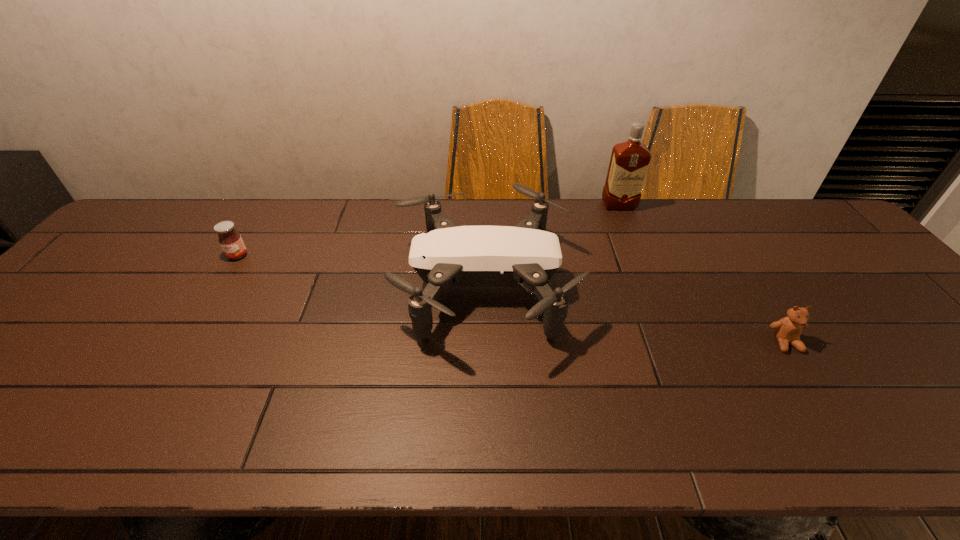
You are a GUI agent. You are given a task and a screenshot of the screen. Output one action in this format:
    pyautogui.click(x=<x>, y=<y>)
    Task: Click on the unoccupied area between the drone and the rightmost object
    
    Given the screenshot: What is the action you would take?
    pyautogui.click(x=635, y=313)

The image size is (960, 540). What are the coordinates of `empty space between the jam and the third shortest object` in the screenshot? It's located at (360, 270).

Image resolution: width=960 pixels, height=540 pixels. I want to click on free space between the jam and the second tallest object, so click(x=360, y=270).

Image resolution: width=960 pixels, height=540 pixels. I want to click on unoccupied position between the drone and the jam, so click(360, 270).

Identify the location of free space between the rightmost object and the third shortest object. This screenshot has height=540, width=960. (635, 313).

Locate which object ranks second in proximity to the rightmost object. Please provide its 2D coordinates. Your answer should be formatted as a tuple, i.e. [(x, y)], where the tuple contains the x and y coordinates of a point satisfying the conditions above.

[(629, 162)]

Identify which object is the third closest to the leftmost object. Please provide its 2D coordinates. Your answer should be formatted as a tuple, i.e. [(x, y)], where the tuple contains the x and y coordinates of a point satisfying the conditions above.

[(787, 330)]

Where is `free space that satisfies the following two spatial constraints: 1. on the front label of the tallest object; 2. on the camera side of the third shortest object`? The width and height of the screenshot is (960, 540). free space that satisfies the following two spatial constraints: 1. on the front label of the tallest object; 2. on the camera side of the third shortest object is located at coordinates [x=651, y=284].

Locate an element on the screen. The image size is (960, 540). free space that satisfies the following two spatial constraints: 1. on the front label of the farthest object; 2. on the camera side of the third object from right to left is located at coordinates (651, 284).